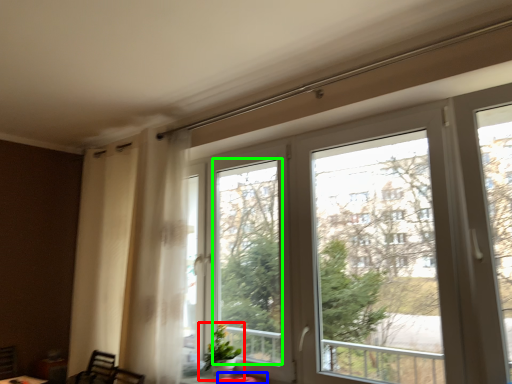
Question: Which object is the farthest from houseplant (highlighted by a red box)? Choose among these: table (highlighted by a blue box) or window screen (highlighted by a green box).

Choices:
 (A) table
 (B) window screen

Answer: (B)